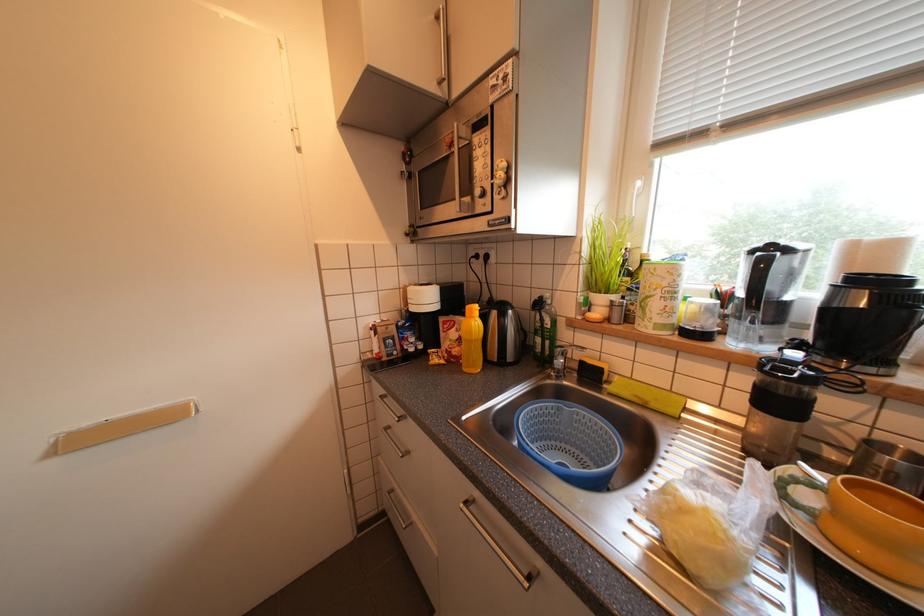
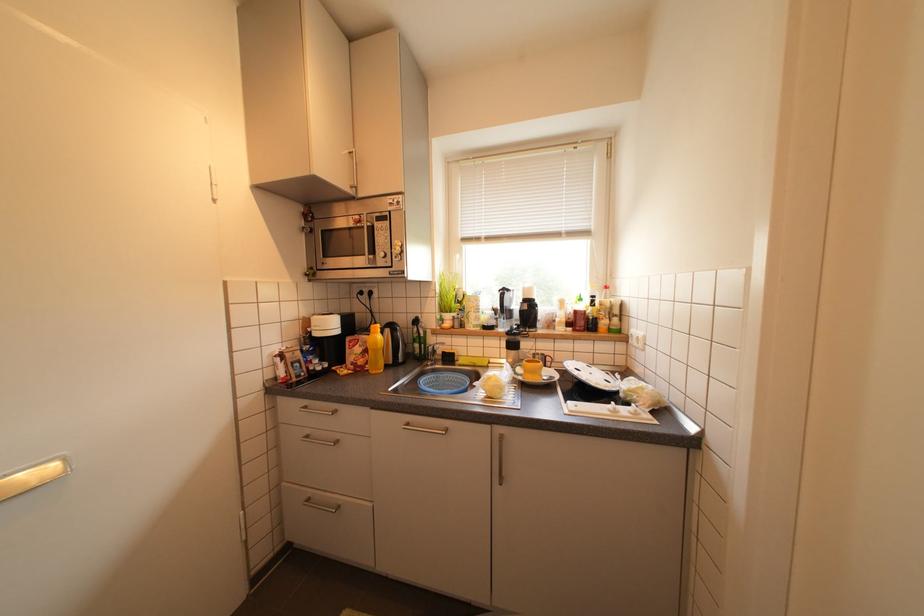
Question: The camera is either moving clockwise (left) or counter-clockwise (right) around the object. The first image is from the beginning of the video and the second image is from the end. Is the camera moving left or right when shooting the video?

Choices:
 (A) Left
 (B) Right

Answer: (A)